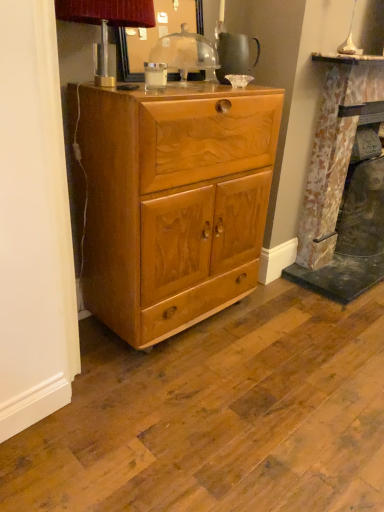
Question: Does point (147, 284) appear closer or farther from the camera than point (359, 207)?

Choices:
 (A) closer
 (B) farther

Answer: (A)

Question: Considering the positions of light brown wood cabinet at center and rustic stone fireplace at right in the image, is light brown wood cabinet at center wider or thinner than rustic stone fireplace at right?

Choices:
 (A) thin
 (B) wide

Answer: (B)

Question: Estimate the real-world distances between objects in this image. Which object is closer to the metallic silver table lamp at upper left, arranged as the second table lamp when viewed from the right?

Choices:
 (A) rustic stone fireplace at right
 (B) glossy wooden mirror at upper center
 (C) light brown wood cabinet at center
 (D) matte silver table lamp at upper center, arranged as the first table lamp when viewed from the right

Answer: (B)

Question: Which of these objects is positioned closest to the rustic stone fireplace at right?

Choices:
 (A) matte silver table lamp at upper center, arranged as the first table lamp when viewed from the right
 (B) light brown wood cabinet at center
 (C) glossy wooden mirror at upper center
 (D) metallic silver table lamp at upper left, arranged as the second table lamp when viewed from the right

Answer: (B)